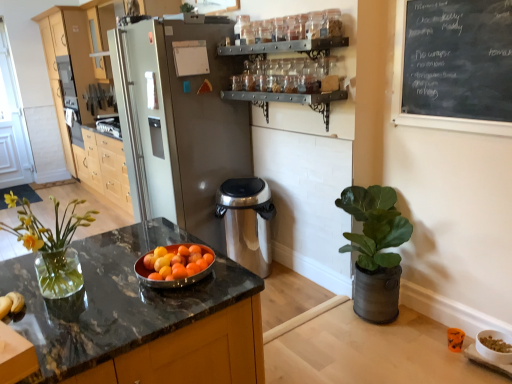
At what (x,y) coordinates should I click in order to perform the action: click on vacant space to the right of clear glass vase at left. Please return your answer as a coordinate pair (x, y). The height and width of the screenshot is (384, 512). Looking at the image, I should click on (134, 299).